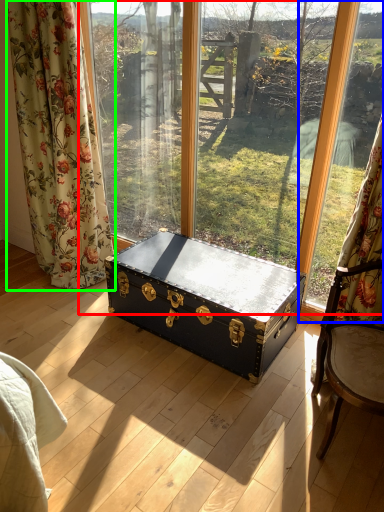
Question: Considering the real-world distances, which object is closest to window (highlighted by a red box)? window frame (highlighted by a blue box) or curtain (highlighted by a green box).

Choices:
 (A) window frame
 (B) curtain

Answer: (A)